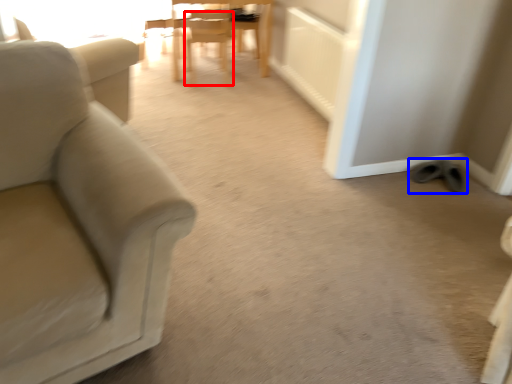
Question: Which of the following is the farthest to the observer, chair (highlighted by a red box) or footwear (highlighted by a blue box)?

Choices:
 (A) chair
 (B) footwear

Answer: (A)